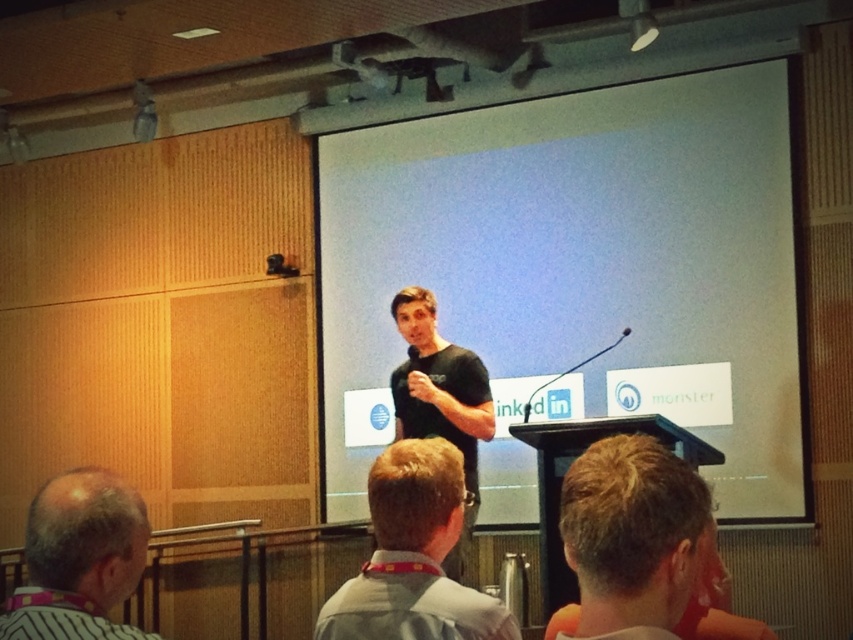
You are standing in the conference room and want to place a black matte t shirt exactly at the center of the room. Is the current position at point (577, 273) suitable for placing the black matte t shirt at center?

Yes, the black matte t shirt at center is already located at point (577, 273), so placing it there would be appropriate.